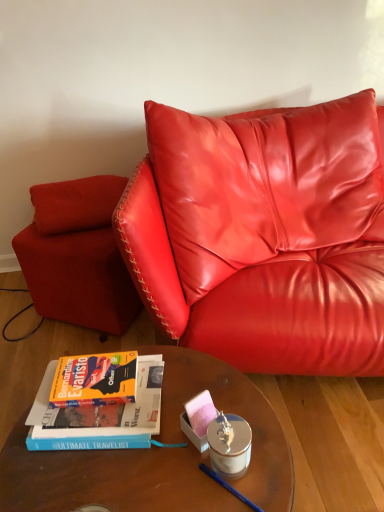
Question: From a real-world perspective, is silver metallic candle holder at center physically above wooden glass table at center?

Choices:
 (A) yes
 (B) no

Answer: (A)

Question: From a real-world perspective, is silver metallic candle holder at center physically below wooden glass table at center?

Choices:
 (A) no
 (B) yes

Answer: (A)

Question: Is silver metallic candle holder at center bigger than wooden glass table at center?

Choices:
 (A) yes
 (B) no

Answer: (B)

Question: From the image's perspective, is silver metallic candle holder at center located beneath wooden glass table at center?

Choices:
 (A) no
 (B) yes

Answer: (A)

Question: Is silver metallic candle holder at center wider than wooden glass table at center?

Choices:
 (A) no
 (B) yes

Answer: (A)

Question: From a real-world perspective, is velvet red pillow at upper left above or below matte red armchair at lower left?

Choices:
 (A) below
 (B) above

Answer: (B)

Question: Relative to matte red armchair at lower left, is velvet red pillow at upper left in front or behind?

Choices:
 (A) front
 (B) behind

Answer: (B)

Question: From the image's perspective, is velvet red pillow at upper left located above or below matte red armchair at lower left?

Choices:
 (A) below
 (B) above

Answer: (B)

Question: Is point (76, 202) positioned closer to the camera than point (105, 214)?

Choices:
 (A) closer
 (B) farther

Answer: (B)

Question: Considering their positions, is matte red armchair at lower left located in front of or behind silver metallic candle holder at center?

Choices:
 (A) behind
 (B) front

Answer: (A)

Question: Visually, is matte red armchair at lower left positioned to the left or to the right of silver metallic candle holder at center?

Choices:
 (A) left
 (B) right

Answer: (A)

Question: From the image's perspective, is matte red armchair at lower left positioned above or below silver metallic candle holder at center?

Choices:
 (A) below
 (B) above

Answer: (B)

Question: From a real-world perspective, is matte red armchair at lower left positioned above or below silver metallic candle holder at center?

Choices:
 (A) above
 (B) below

Answer: (B)

Question: Would you say silver metallic candle holder at center is to the left or to the right of wooden glass table at center in the picture?

Choices:
 (A) right
 (B) left

Answer: (A)

Question: In terms of height, does silver metallic candle holder at center look taller or shorter compared to wooden glass table at center?

Choices:
 (A) short
 (B) tall

Answer: (A)